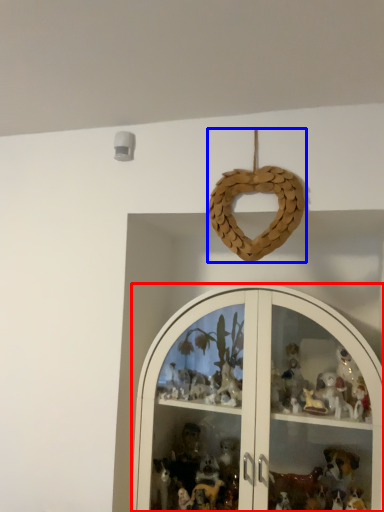
Question: Which of the following is the farthest to the observer, shelf (highlighted by a red box) or toy (highlighted by a blue box)?

Choices:
 (A) shelf
 (B) toy

Answer: (B)